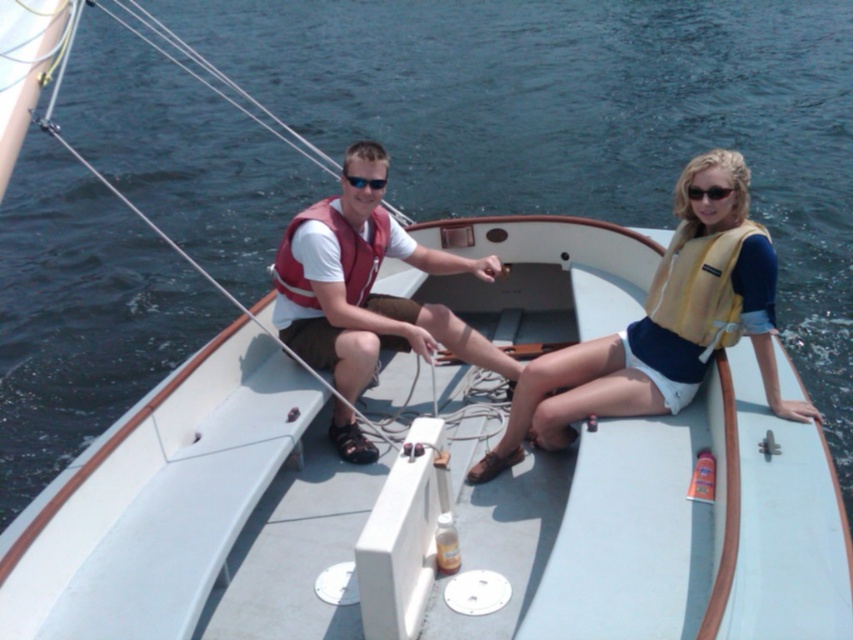
Question: Is white matte boat at center smaller than black plastic sunglasses at upper right?

Choices:
 (A) no
 (B) yes

Answer: (A)

Question: Among these objects, which one is nearest to the camera?

Choices:
 (A) white matte boat at center
 (B) yellow life vest at center
 (C) matte red life jacket at center

Answer: (A)

Question: Can you confirm if white matte boat at center is thinner than yellow life vest at center?

Choices:
 (A) yes
 (B) no

Answer: (B)

Question: Which point is farther to the camera?

Choices:
 (A) (752, 412)
 (B) (384, 180)
 (C) (670, 275)
 (D) (662, 298)

Answer: (B)

Question: Which is farther from the sunglasses at center?

Choices:
 (A) matte red life vest at center
 (B) white matte boat at center
 (C) yellow/yellowish fabric life jacket at upper right

Answer: (C)

Question: In this image, where is matte red life jacket at center located relative to sunglasses at center?

Choices:
 (A) below
 (B) above

Answer: (A)